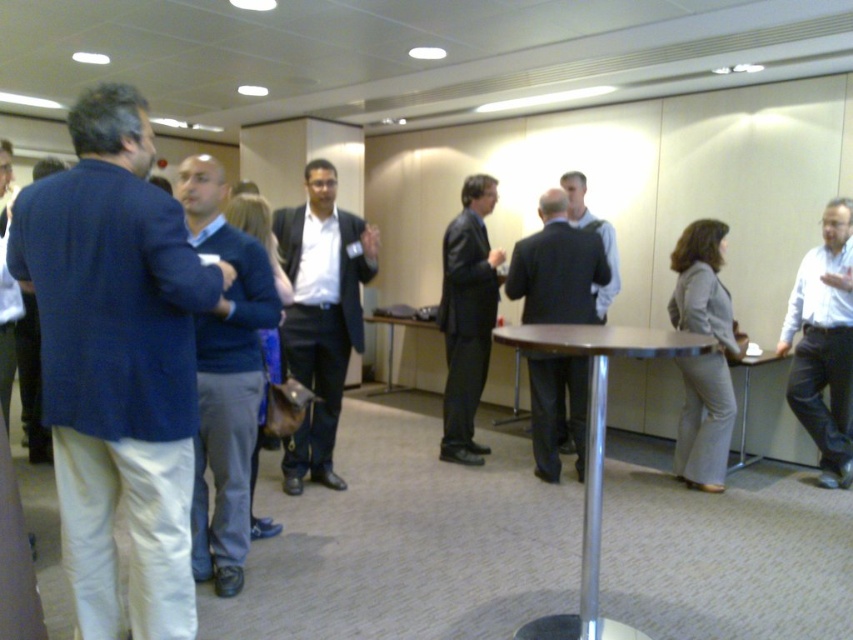
Who is more forward, (183, 227) or (474, 381)?

Point (183, 227) is more forward.

Is dark blue sweater at left thinner than black leather suit at center?

No.

Does point (13, 240) lie behind point (483, 182)?

No.

Find the location of a particular element. This screenshot has width=853, height=640. dark blue sweater at left is located at coordinates (117, 362).

Is point (709, 392) positioned in front of point (451, 376)?

That is True.

Can you confirm if gray fabric suit at right is shorter than black leather suit at center?

Yes.

I want to click on gray fabric suit at right, so click(x=703, y=355).

Who is more distant from viewer, (383,388) or (746,403)?

Positioned behind is point (383,388).

Does wooden table at center have a smaller size compared to metallic silver table at center?

No, wooden table at center is not smaller than metallic silver table at center.

Based on the photo, who is more forward, (387, 369) or (733, 465)?

Point (733, 465)

You are a GUI agent. You are given a task and a screenshot of the screen. Output one action in this format:
    pyautogui.click(x=<x>, y=<y>)
    Task: Click on the wooden table at center
    Image resolution: width=853 pixels, height=640 pixels.
    Given the screenshot: What is the action you would take?
    pyautogui.click(x=393, y=342)